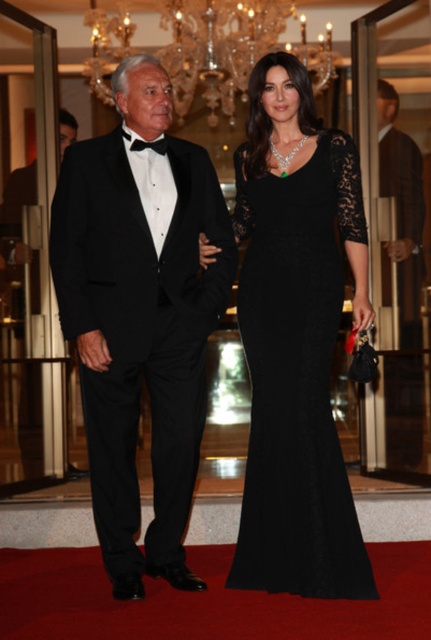
You are a photographer at the event and need to position the two subjects so that their clothing items appear balanced in the frame. Given that the matte black tuxedo at left and the smooth brown leather coat at right have different heights, which clothing item should be placed closer to the camera to create a balanced composition?

The smooth brown leather coat at right should be placed closer to the camera since it is shorter than the matte black tuxedo at left. This adjustment will help balance their heights in the frame.

You are a photographer at the event and need to capture a closeup shot of both the smooth brown leather coat at right and the black satin bow tie at center. Since your camera can only focus on one object at a time, which object should you adjust the focus to first if you want to ensure the wider object is in focus?

The smooth brown leather coat at right is wider than the black satin bow tie at center. Therefore, you should focus on the smooth brown leather coat at right first to ensure its wider area is captured clearly.

You are a photographer at the event and need to ensure both the matte black tuxedo at left and the smooth brown leather coat at right are fully visible in your shot. Given that the camera frame can only accommodate items up to the size of the larger object, will both fit within the frame?

The matte black tuxedo at left is larger than the smooth brown leather coat at right. Since the camera frame can accommodate up to the size of the larger object, both will fit within the frame as the larger one already fits.